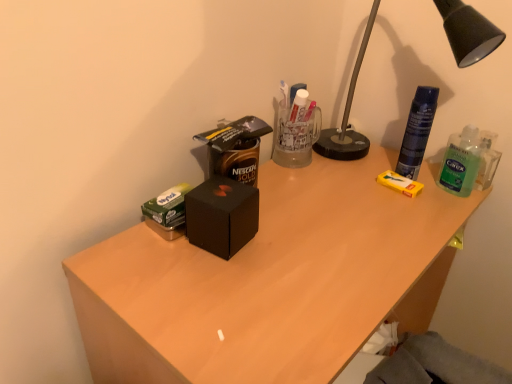
Question: From a real-world perspective, is green translucent hand sanitizer at right above or below black metal lamp at upper right?

Choices:
 (A) above
 (B) below

Answer: (B)

Question: In terms of height, does green translucent hand sanitizer at right look taller or shorter compared to black metal lamp at upper right?

Choices:
 (A) short
 (B) tall

Answer: (A)

Question: Based on their relative distances, which object is nearer to the green translucent hand sanitizer at right?

Choices:
 (A) black matte box at center
 (B) matte black box at center
 (C) black metal lamp at upper right

Answer: (C)

Question: Considering the real-world distances, which object is closest to the green translucent hand sanitizer at right?

Choices:
 (A) matte black box at center
 (B) black matte box at center
 (C) black metal lamp at upper right

Answer: (C)